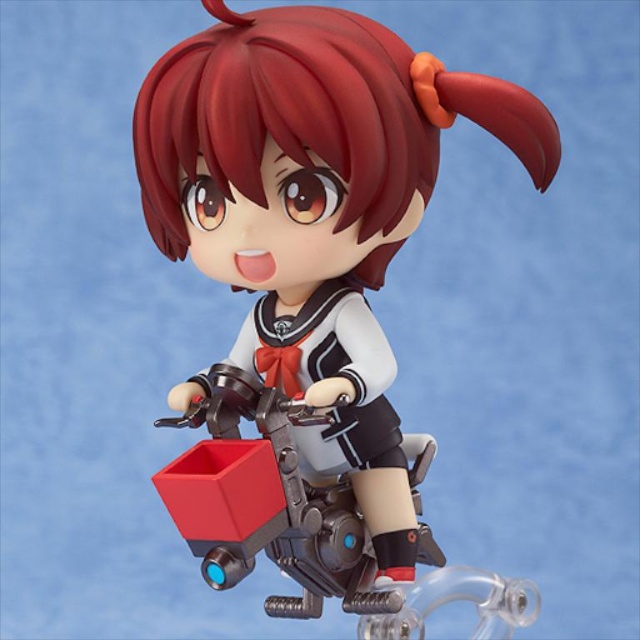
Based on the scene description, can you determine if the matte black figure at center is wider than the satin red hair at center?

The Objects Description states that the matte black figure at center might be wider than satin red hair at center, so it is possible that the matte black figure at center is wider than the satin red hair at center.

Based on the photo, you are a collector examining the figurine. You want to know if the matte black figure at center can be placed in a display case that can only accommodate items up to the size of the satin red hair at center. Can it fit?

The matte black figure at center is bigger than the satin red hair at center, so it cannot fit in the display case designed for the size of the satin red hair at center.

You are an art collector examining a new figurine. The figurine has a point marked at coordinates [312,300]. Where exactly is this point located on the figurine?

The point at coordinates [312,300] is located at the center of the matte black figure.